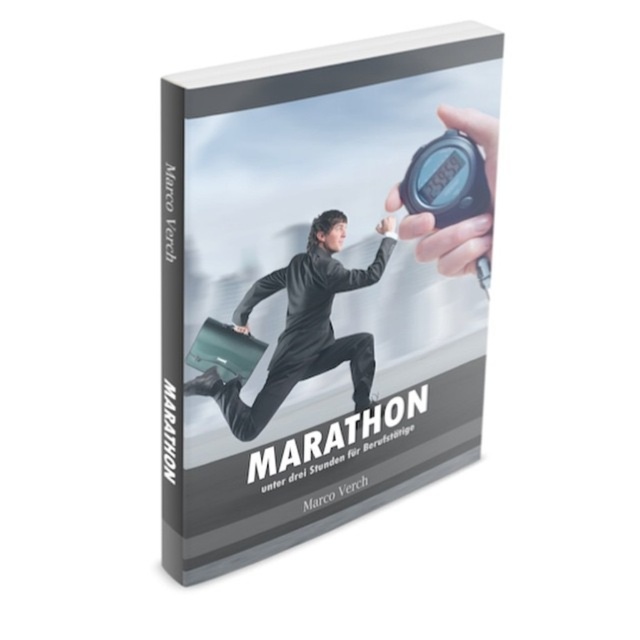
Question: Can you confirm if black matte suit at center is bigger than black plastic stopwatch at upper right?

Choices:
 (A) no
 (B) yes

Answer: (B)

Question: Which of these objects is positioned closest to the black plastic stopwatch at upper right?

Choices:
 (A) black matte suit at center
 (B) matte black book at center

Answer: (A)

Question: Is the position of matte black book at center more distant than that of black matte suit at center?

Choices:
 (A) no
 (B) yes

Answer: (A)

Question: Observing the image, what is the correct spatial positioning of black matte suit at center in reference to black plastic stopwatch at upper right?

Choices:
 (A) below
 (B) above

Answer: (A)

Question: Which of the following is the farthest from the observer?

Choices:
 (A) black plastic stopwatch at upper right
 (B) black matte suit at center
 (C) matte black book at center

Answer: (A)

Question: Among these objects, which one is nearest to the camera?

Choices:
 (A) matte black book at center
 (B) black plastic stopwatch at upper right
 (C) black matte suit at center

Answer: (A)